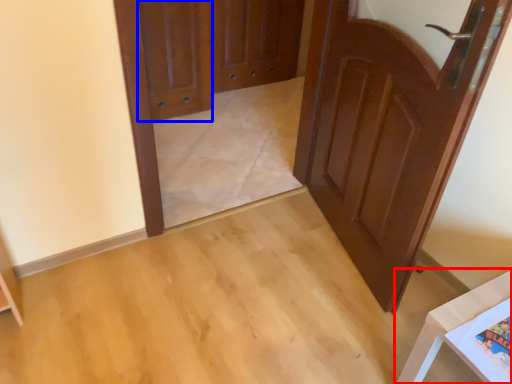
Question: Which object is closer to the camera taking this photo, furniture (highlighted by a red box) or door (highlighted by a blue box)?

Choices:
 (A) furniture
 (B) door

Answer: (A)